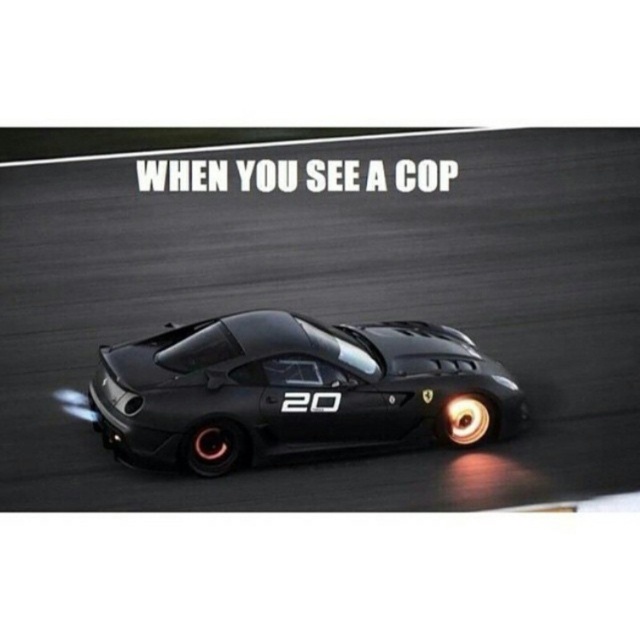
Between black asphalt at center and matte black sports car at center, which one appears on the right side from the viewer's perspective?

Positioned to the right is black asphalt at center.

Is black asphalt at center above matte black sports car at center?

Indeed, black asphalt at center is positioned over matte black sports car at center.

Who is more forward, (465,307) or (209,353)?

Point (209,353)

This screenshot has height=640, width=640. In order to click on black asphalt at center in this screenshot , I will do `click(337, 307)`.